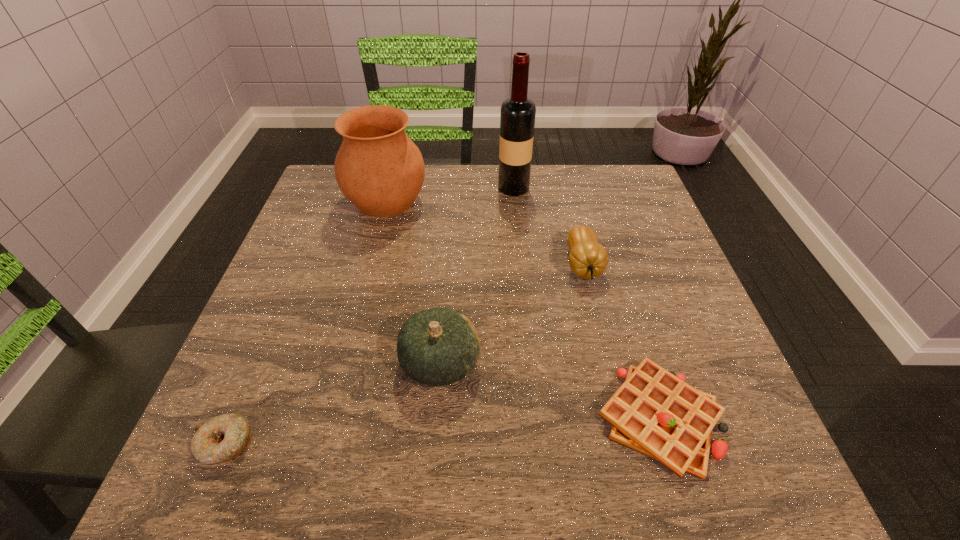
Find the location of a particular element. The height and width of the screenshot is (540, 960). vacant area located 0.390m on the left of the fourth object from left to right is located at coordinates (354, 187).

Image resolution: width=960 pixels, height=540 pixels. Identify the location of vacant area located 0.150m on the front of the fifth shortest object. (369, 269).

At what (x,y) coordinates should I click in order to perform the action: click on vacant space positioned 0.080m on the left of the nearer gourd. Please return your answer as a coordinate pair (x, y). This screenshot has height=540, width=960. Looking at the image, I should click on (356, 362).

Locate an element on the screen. The width and height of the screenshot is (960, 540). free space located 0.270m on the stem side of the fourth nearest object is located at coordinates (617, 410).

Image resolution: width=960 pixels, height=540 pixels. In order to click on vacant space located on the back of the second shortest object in this screenshot , I will do `click(618, 289)`.

Find the location of a particular element. vacant position located on the back of the leftmost object is located at coordinates (277, 320).

You are a GUI agent. You are given a task and a screenshot of the screen. Output one action in this format:
    pyautogui.click(x=<x>, y=<y>)
    Task: Click on the wine bottle at the far edge
    The height and width of the screenshot is (540, 960).
    Given the screenshot: What is the action you would take?
    pyautogui.click(x=517, y=118)

Locate an element on the screen. pottery located at the far edge is located at coordinates (379, 169).

Image resolution: width=960 pixels, height=540 pixels. I want to click on waffle that is positioned at the near edge, so click(x=654, y=412).

Where is `doughnut positioned at the near edge`? The height and width of the screenshot is (540, 960). doughnut positioned at the near edge is located at coordinates (223, 438).